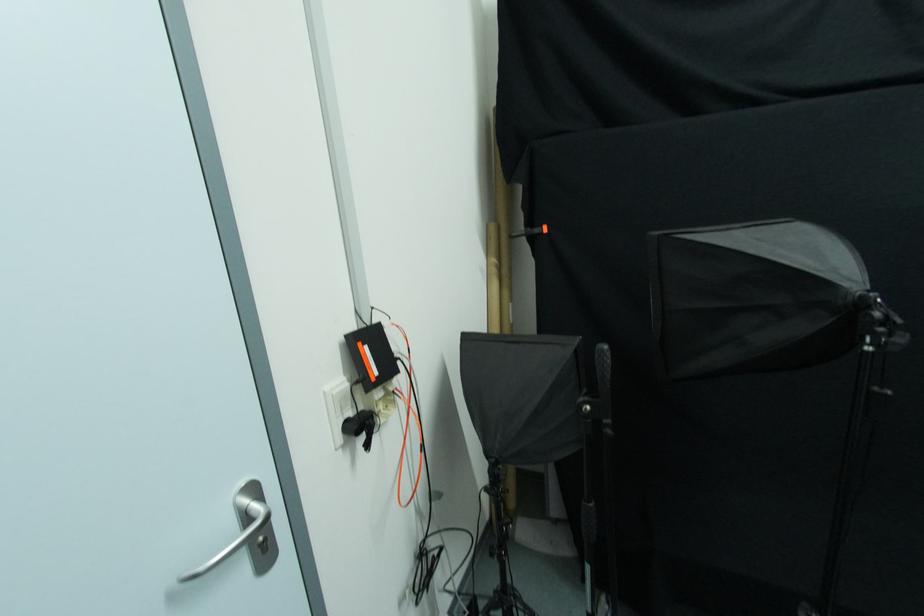
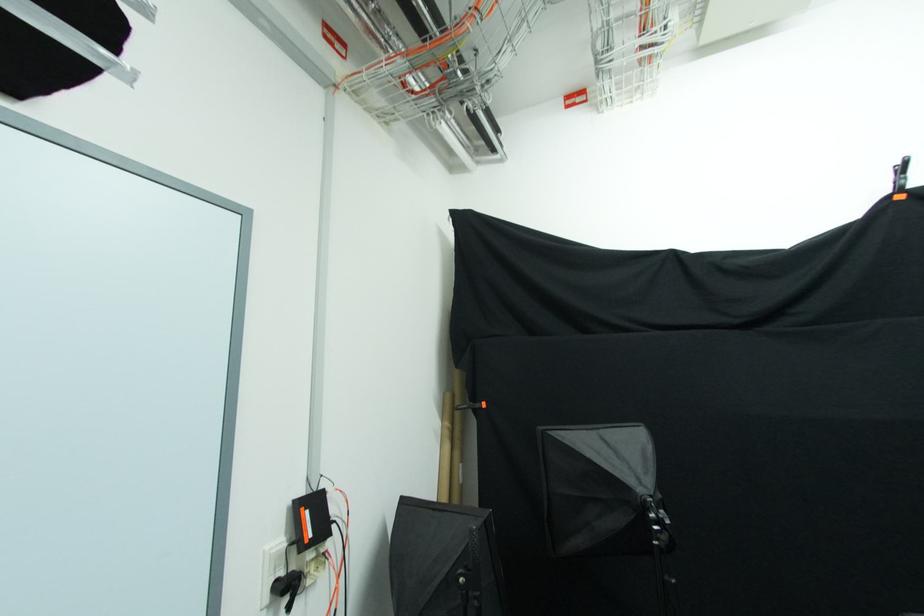
Where in the second image is the point corresponding to point 513,307 from the first image?

(462, 468)